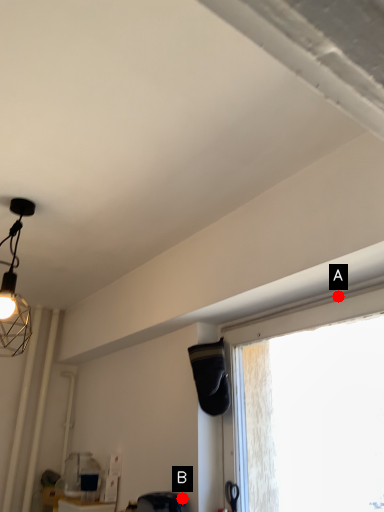
Question: Two points are circled on the image, labeled by A and B beside each circle. Which point is further to the camera?

Choices:
 (A) A is further
 (B) B is further

Answer: (B)